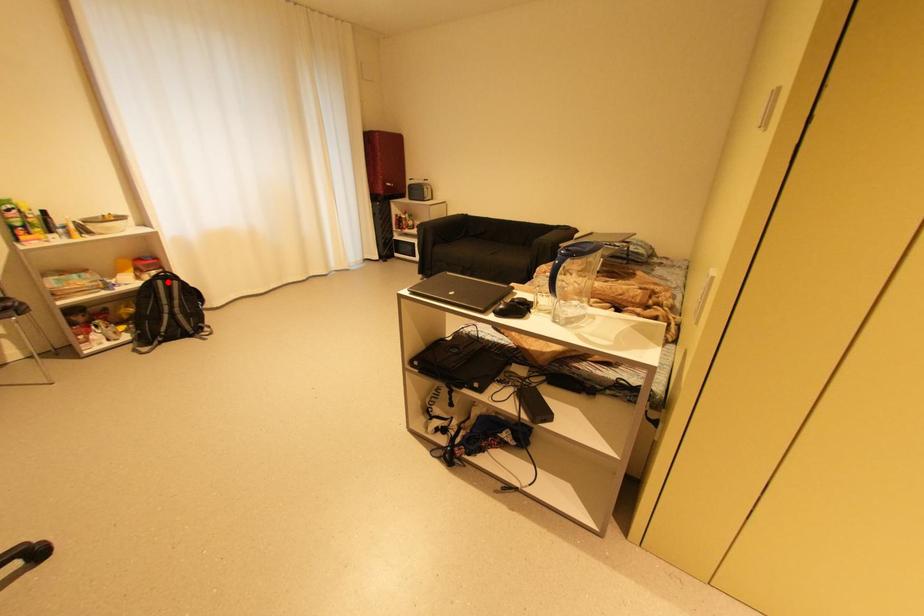
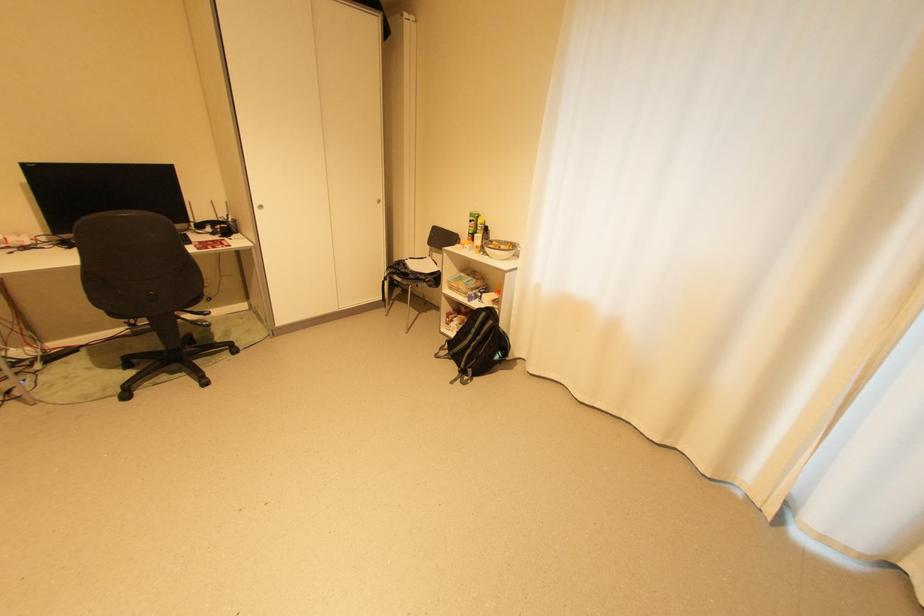
In the second image, find the point that corresponds to the highlighted location in the first image.

(492, 314)